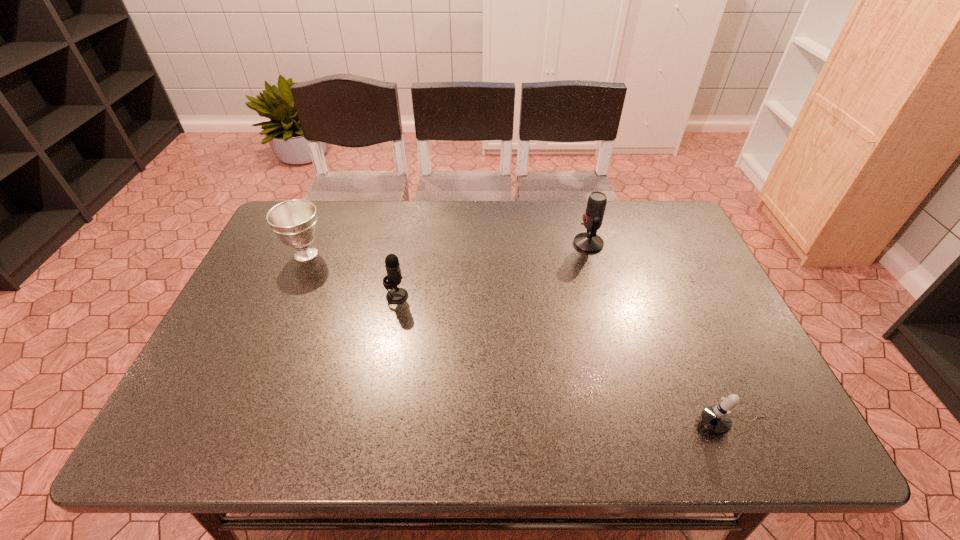
Find the location of a particular element. vacant space in between the leftmost object and the second microphone from left to right is located at coordinates (447, 249).

The image size is (960, 540). Identify the location of free spot between the nearest object and the chalice. (519, 340).

The image size is (960, 540). Find the location of `vacant space that is in between the second nearest microphone and the farthest microphone`. vacant space that is in between the second nearest microphone and the farthest microphone is located at coordinates (492, 270).

Find the location of `vacant space that is in between the farthest microphone and the chalice`. vacant space that is in between the farthest microphone and the chalice is located at coordinates (447, 249).

Where is `vacant area that lies between the farthest microphone and the second tallest microphone`? The image size is (960, 540). vacant area that lies between the farthest microphone and the second tallest microphone is located at coordinates (492, 270).

Where is `free space between the nearest microphone and the chalice`? The image size is (960, 540). free space between the nearest microphone and the chalice is located at coordinates (519, 340).

The height and width of the screenshot is (540, 960). I want to click on object that is the second nearest to the leftmost microphone, so click(x=589, y=242).

Where is `object that is the third nearest to the second nearest object`? The width and height of the screenshot is (960, 540). object that is the third nearest to the second nearest object is located at coordinates (716, 419).

Select which microphone appears as the second closest to the farthest microphone. Please provide its 2D coordinates. Your answer should be formatted as a tuple, i.e. [(x, y)], where the tuple contains the x and y coordinates of a point satisfying the conditions above.

[(716, 419)]

The height and width of the screenshot is (540, 960). Find the location of `the second closest microphone relative to the second farthest microphone`. the second closest microphone relative to the second farthest microphone is located at coordinates (716, 419).